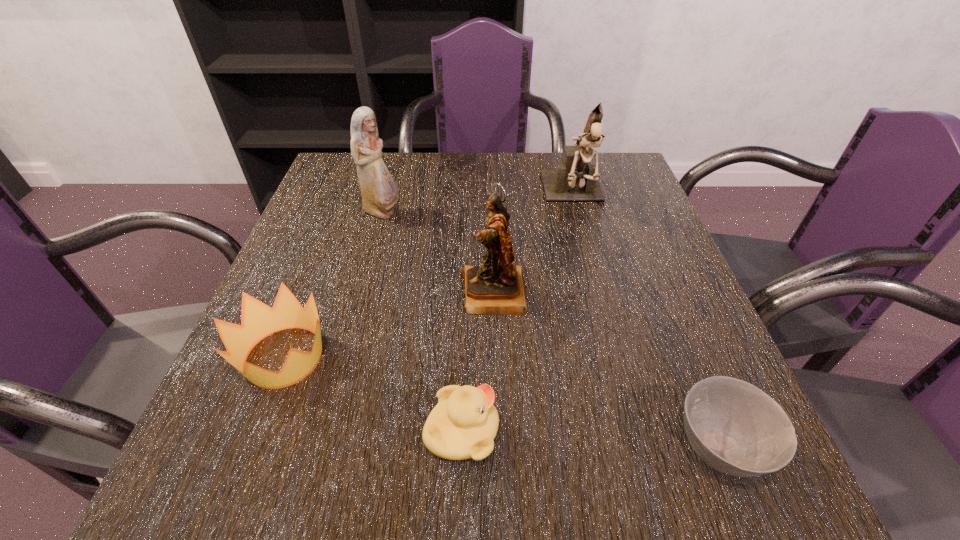
Locate an element on the screen. This screenshot has width=960, height=540. vacant point located between the crown and the duckling is located at coordinates (373, 394).

This screenshot has width=960, height=540. I want to click on free space between the nearest figurine and the duckling, so click(478, 362).

Where is `free space between the leftmost figurine and the bowl`? free space between the leftmost figurine and the bowl is located at coordinates (550, 330).

Identify the location of free area in between the bowl and the crown. (501, 402).

Image resolution: width=960 pixels, height=540 pixels. Identify the location of free space between the rightmost figurine and the bowl. (646, 322).

The width and height of the screenshot is (960, 540). In order to click on vacant area that lies between the nearest figurine and the bowl in this screenshot , I will do `click(606, 370)`.

Identify the location of free space between the duckling and the bowl. (590, 439).

Image resolution: width=960 pixels, height=540 pixels. In order to click on free point between the rightmost figurine and the nearest figurine in this screenshot , I will do `click(534, 245)`.

Locate an element on the screen. This screenshot has width=960, height=540. object identified as the second closest to the crown is located at coordinates (496, 287).

Locate which object is the closest to the nearest figurine. Please provide its 2D coordinates. Your answer should be formatted as a tuple, i.e. [(x, y)], where the tuple contains the x and y coordinates of a point satisfying the conditions above.

[(463, 425)]